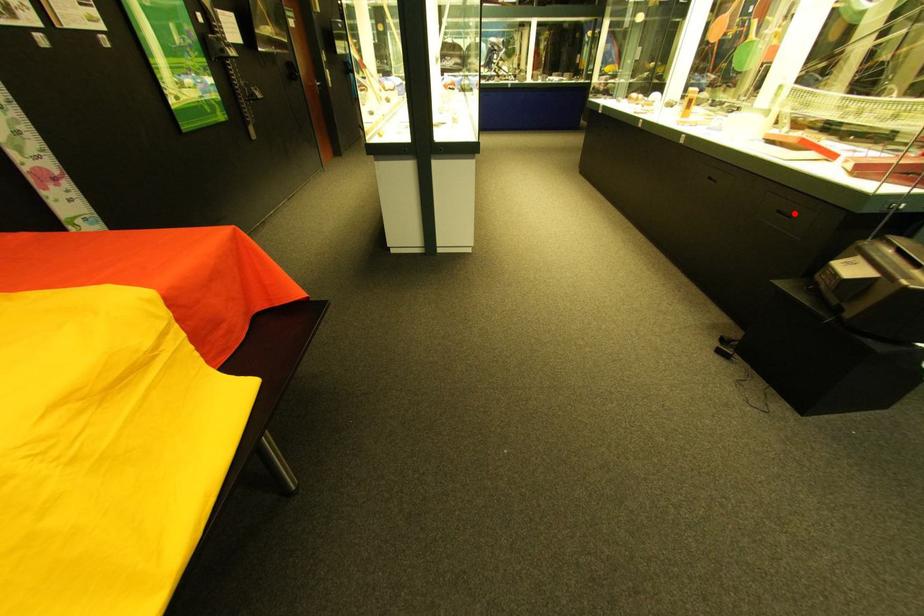
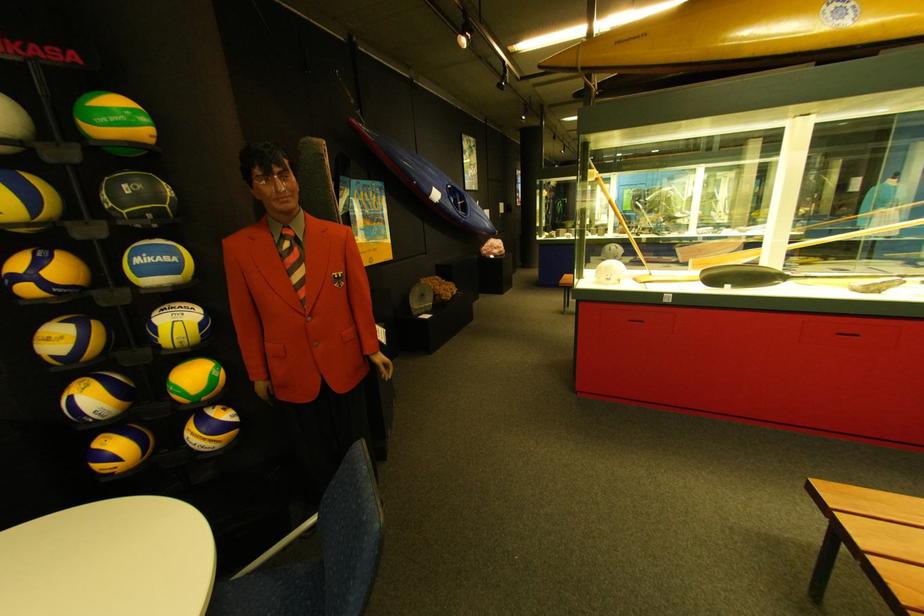
Question: I am providing you with two images of the same scene from different viewpoints. A red point is marked on the first image. Is the red point's position out of view in image 2?

Choices:
 (A) Yes
 (B) No

Answer: (A)